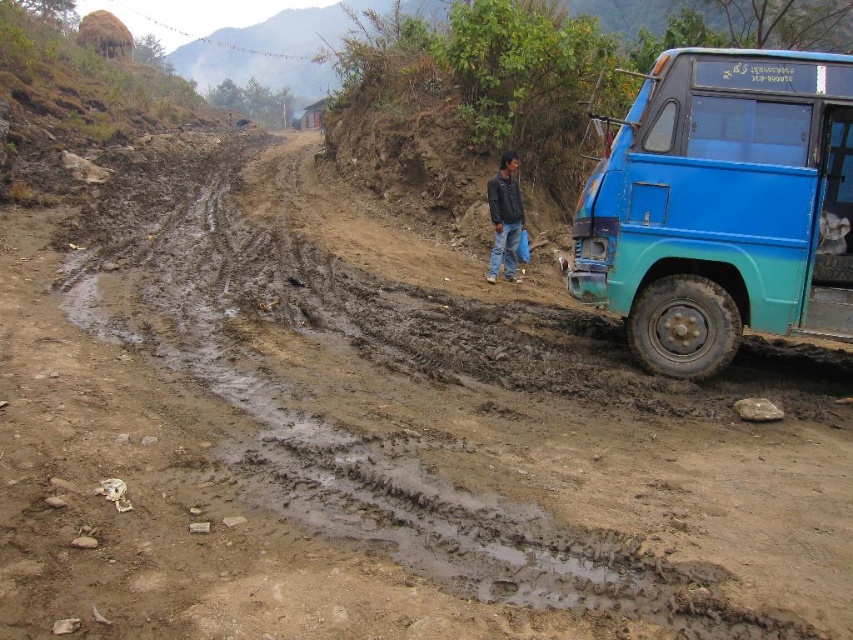
You are standing on the muddy road and want to reach the point marked at coordinates (763,243). The road is muddy and has deep ruts. Can you safely walk to that point without slipping?

The point at coordinates (763,243) is 20.64 feet away from you. Since the road is muddy with deep ruts and puddles, walking that distance might be risky due to the slippery conditions. Use caution or consider a safer path.

You are a delivery driver trying to navigate through the muddy road. You see the blue matte truck at right stuck in the mud. Based on its position, can you estimate how far it is from the edge of the road?

The blue matte truck at right is located at point (722,205), which suggests it is positioned closer to the right edge of the road. However, without knowing the exact dimensions of the road or the coordinate system used, it is difficult to provide an accurate distance. You should proceed with caution and assess the terrain visually before attempting to pass.

You are driving a car that is 4 meters long. You see a blue matte truck at right. How much space is there between you and the truck?

There is 6.12 meters between you and the blue matte truck at right.